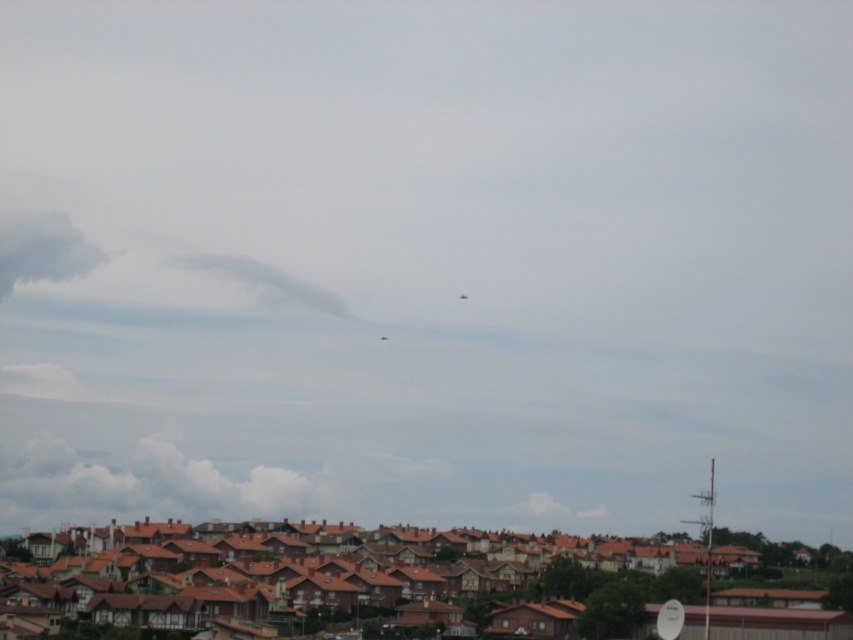
Question: Can you confirm if brown tiled roofs at lower center is thinner than gray fluffy cloud at upper left?

Choices:
 (A) no
 (B) yes

Answer: (A)

Question: Among these objects, which one is nearest to the camera?

Choices:
 (A) brown tiled roofs at lower center
 (B) gray fluffy cloud at upper left
 (C) white fluffy cloud at lower left
 (D) white fluffy cloud at upper center

Answer: (A)

Question: Can you confirm if brown tiled roofs at lower center is bigger than white fluffy cloud at upper center?

Choices:
 (A) yes
 (B) no

Answer: (A)

Question: Which object is farther from the camera taking this photo?

Choices:
 (A) white fluffy cloud at lower left
 (B) gray fluffy cloud at upper left
 (C) white fluffy cloud at upper center
 (D) brown tiled roofs at lower center

Answer: (B)

Question: Can you confirm if white fluffy cloud at lower left is bigger than white fluffy cloud at upper center?

Choices:
 (A) yes
 (B) no

Answer: (A)

Question: Which point is farther to the camera?

Choices:
 (A) gray fluffy cloud at upper left
 (B) brown tiled roofs at lower center
 (C) white fluffy cloud at lower left

Answer: (A)